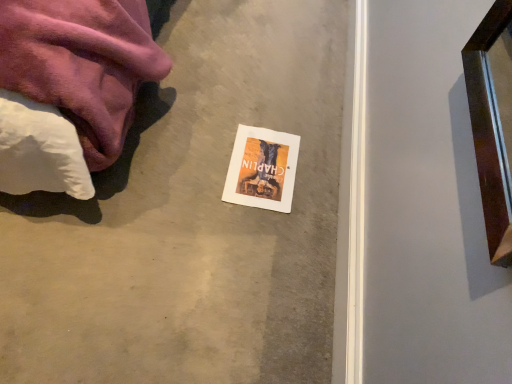
Image resolution: width=512 pixels, height=384 pixels. I want to click on spots to the right of orange matte paper flyer at center, so click(313, 182).